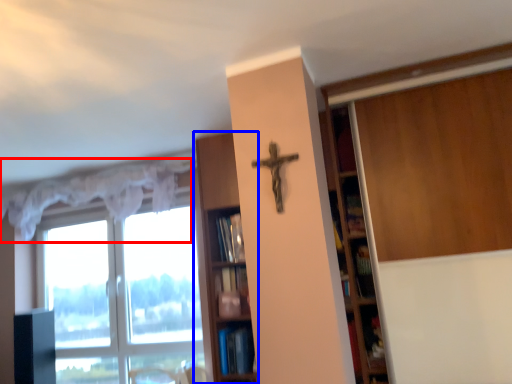
Question: Which object is closer to the camera taking this photo, curtain (highlighted by a red box) or shelf (highlighted by a blue box)?

Choices:
 (A) curtain
 (B) shelf

Answer: (B)